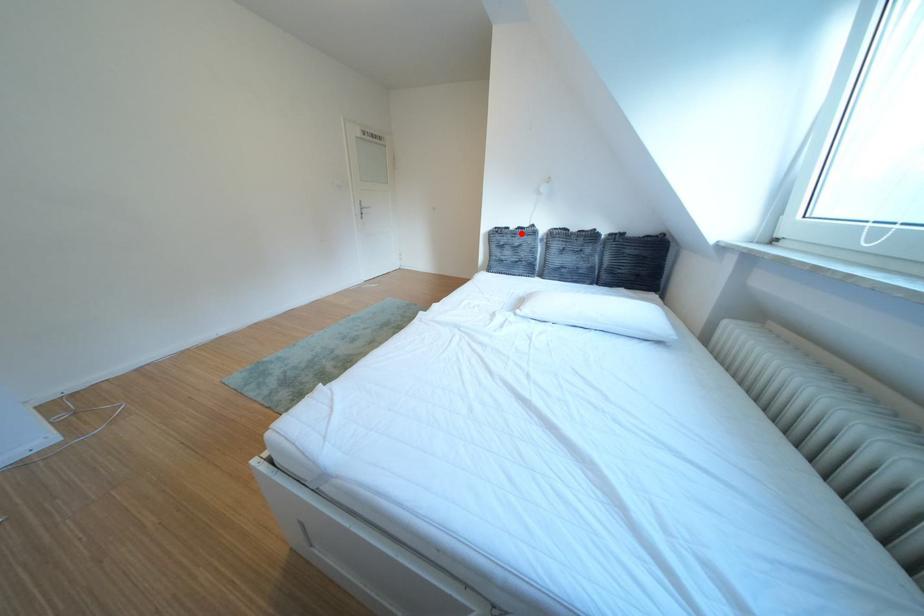
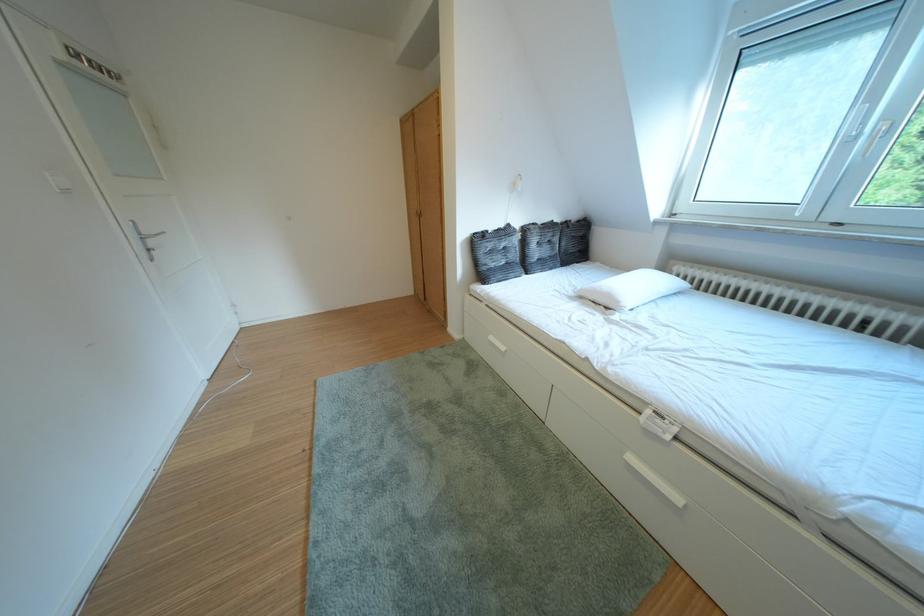
Find the pixel in the second image that matches the highlighted location in the first image.

(500, 237)